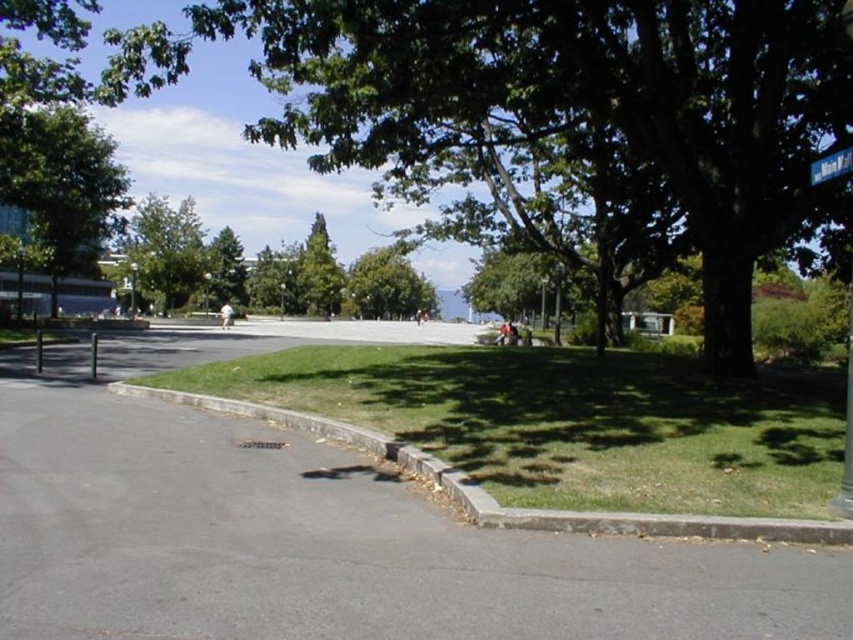
You are a park visitor trying to decide between two shaded areas under the green leafy tree at upper left and the green leafy tree at center. Which tree provides a wider shaded area?

The green leafy tree at upper left provides a wider shaded area since its width surpasses that of the green leafy tree at center.

You are a gardener planning to install a new fence along the edge of the green grass at lower center and the metallic pole at left. Based on their widths, which object requires a wider section of the fence to accommodate it?

The green grass at lower center requires a wider section of the fence since its width surpasses that of the metallic pole at left.